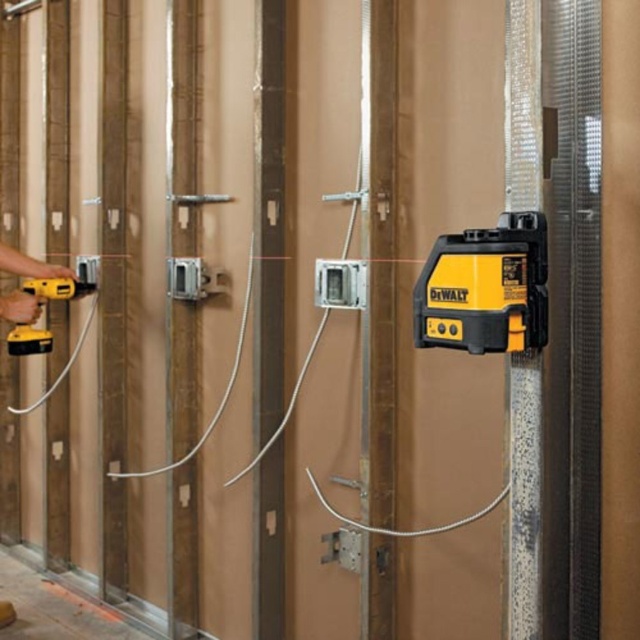
Does yellow/black plastic laser level at center lie behind yellow/black power drill at left?

No, it is in front of yellow/black power drill at left.

Does yellow/black plastic laser level at center have a greater height compared to yellow/black power drill at left?

Incorrect, yellow/black plastic laser level at center's height is not larger of yellow/black power drill at left's.

Which is behind, point (532, 292) or point (97, 264)?

The point (97, 264) is more distant.

At what (x,y) coordinates should I click in order to perform the action: click on yellow/black plastic laser level at center. Please return your answer as a coordinate pair (x, y). This screenshot has height=640, width=640. Looking at the image, I should click on (484, 289).